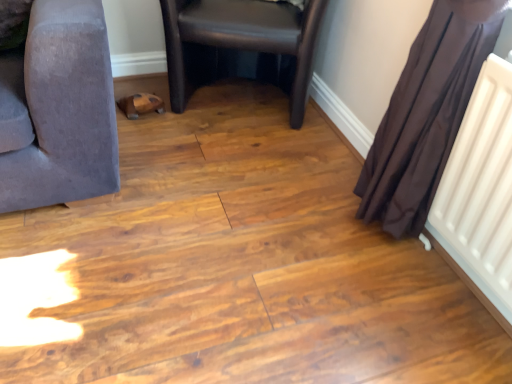
Question: In terms of width, does brown sheer curtain at right look wider or thinner when compared to black leather chair at center?

Choices:
 (A) wide
 (B) thin

Answer: (B)

Question: Based on their sizes in the image, would you say brown sheer curtain at right is bigger or smaller than black leather chair at center?

Choices:
 (A) small
 (B) big

Answer: (A)

Question: Considering their positions, is brown sheer curtain at right located in front of or behind black leather chair at center?

Choices:
 (A) behind
 (B) front

Answer: (B)

Question: Looking at the image, does black leather chair at center seem bigger or smaller compared to brown sheer curtain at right?

Choices:
 (A) small
 (B) big

Answer: (B)

Question: Does point (308, 59) appear closer or farther from the camera than point (488, 39)?

Choices:
 (A) closer
 (B) farther

Answer: (B)

Question: Looking at their shapes, would you say black leather chair at center is wider or thinner than brown sheer curtain at right?

Choices:
 (A) thin
 (B) wide

Answer: (B)

Question: Relative to brown sheer curtain at right, is black leather chair at center in front or behind?

Choices:
 (A) behind
 (B) front

Answer: (A)